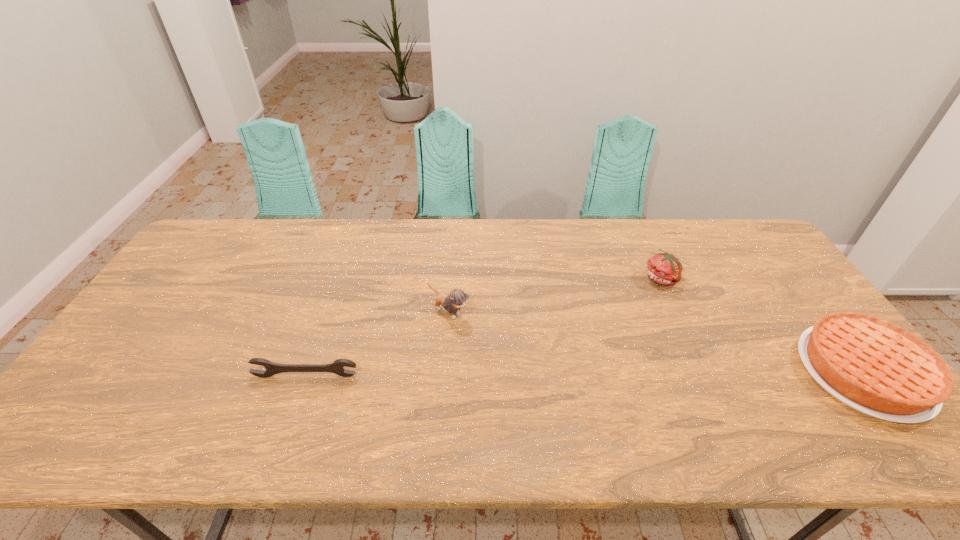
Locate an element on the screen. Image resolution: width=960 pixels, height=540 pixels. vacant space situated on the front-facing side of the kitten is located at coordinates (505, 350).

This screenshot has height=540, width=960. In order to click on free space at the far edge of the desktop in this screenshot , I will do pos(600,240).

Find the location of `vacant space at the near edge`. vacant space at the near edge is located at coordinates (340, 404).

I want to click on vacant space at the left edge of the desktop, so click(x=114, y=355).

Where is `empty space that is in between the wrench and the tallest object`? The width and height of the screenshot is (960, 540). empty space that is in between the wrench and the tallest object is located at coordinates (377, 344).

This screenshot has height=540, width=960. Identify the location of free space between the kitten and the third shortest object. (556, 295).

You are a GUI agent. You are given a task and a screenshot of the screen. Output one action in this format:
    pyautogui.click(x=<x>, y=<y>)
    Task: Click on the vacant space that is in between the farthest object and the tallest object
    This screenshot has width=960, height=540.
    Given the screenshot: What is the action you would take?
    pyautogui.click(x=556, y=295)

Identify the location of vacant space that's between the third shortest object and the wrench. (485, 327).

Identify the location of empty space between the leftmost object and the kitten. This screenshot has width=960, height=540. (377, 344).

Point out which object is positioned as the third nearest to the rightmost object. Please provide its 2D coordinates. Your answer should be formatted as a tuple, i.e. [(x, y)], where the tuple contains the x and y coordinates of a point satisfying the conditions above.

[(336, 367)]